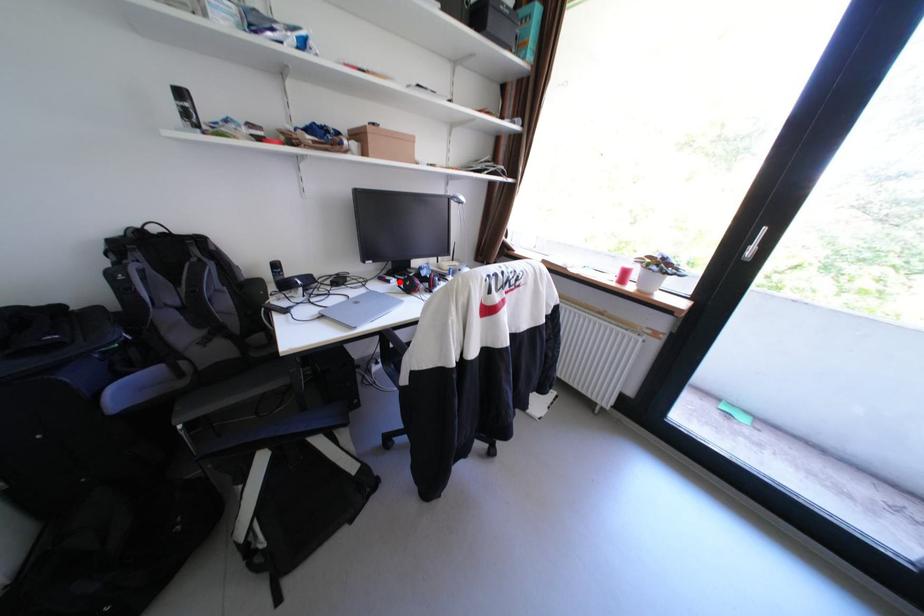
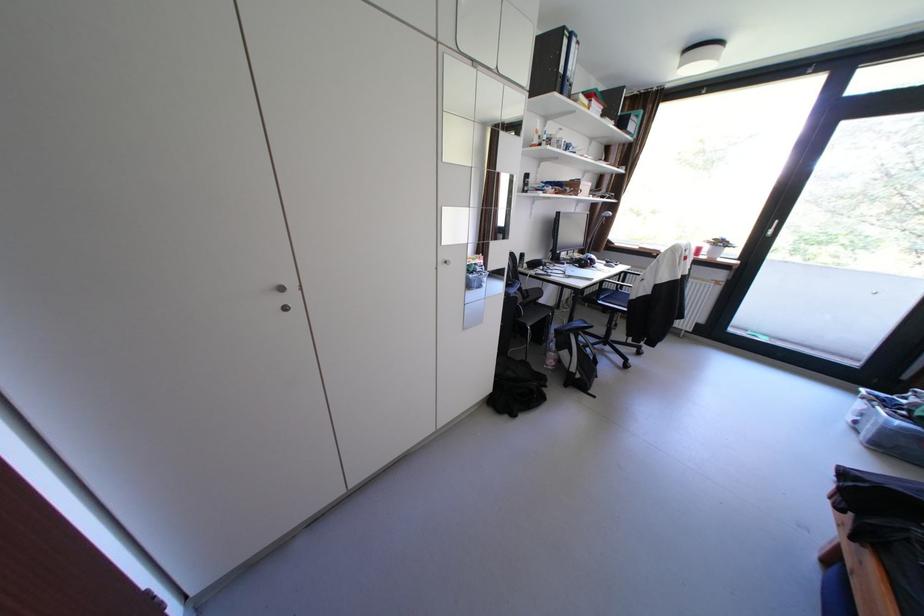
Question: I am providing you with two images of the same scene from different viewpoints. A red point is marked on the first image. Can you still see the location of the red point in image 2?

Choices:
 (A) Yes
 (B) No

Answer: (A)